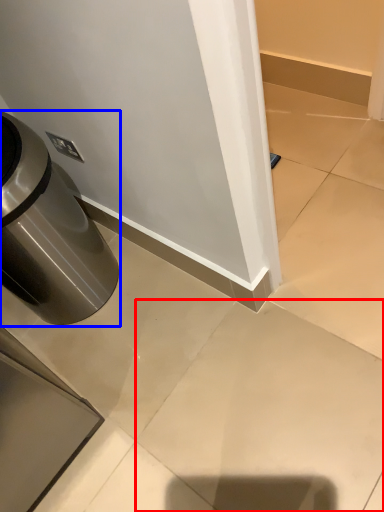
Question: Which object is closer to the camera taking this photo, concrete (highlighted by a red box) or waste container (highlighted by a blue box)?

Choices:
 (A) concrete
 (B) waste container

Answer: (A)